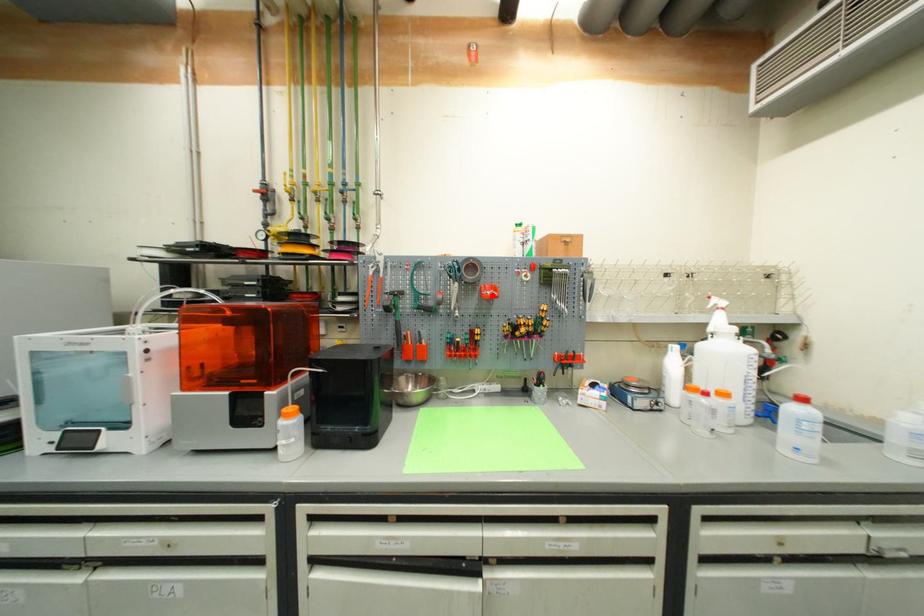
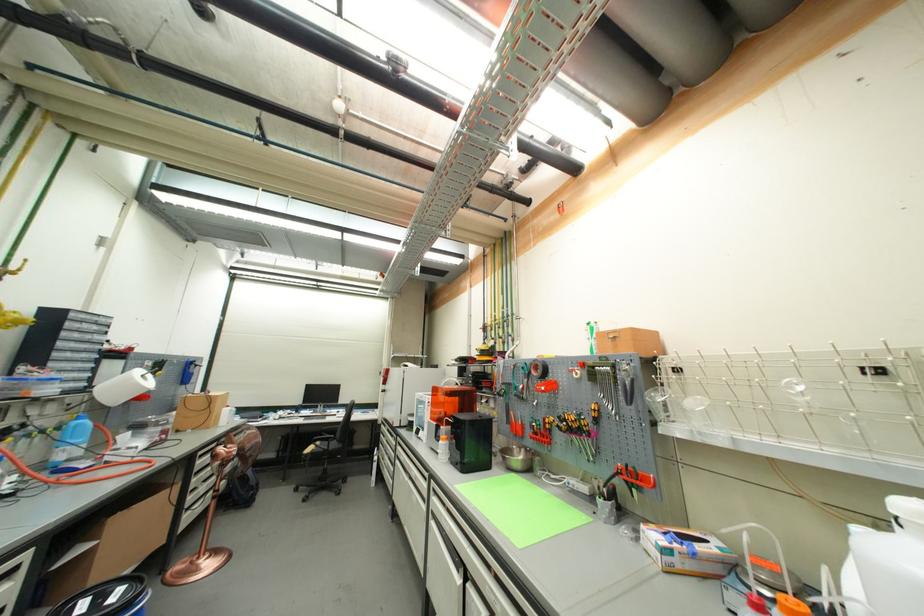
Find the pixel in the second image that matches the highlighted location in the first image.

(544, 390)